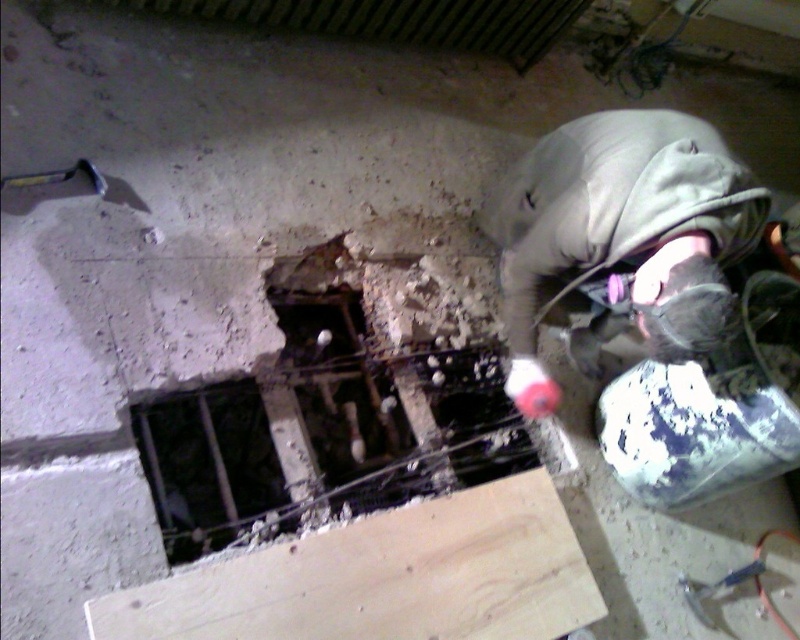
You are a safety inspector standing at the edge of the construction site. You notice the light brown wood plank at lower center and the gray fabric construction worker at upper right. Based on the distance between them, can you determine if the worker is within the safe zone required by regulations?

The light brown wood plank at lower center is 25.74 inches from gray fabric construction worker at upper right. Since the required safe distance is typically over 30 inches, the worker is too close and not within the safe zone.

You are a construction worker who needs to place a new support beam. The beam requires a base that is wider than the dark metal bars at center. Can the light brown wood plank at lower center serve as this base?

The light brown wood plank at lower center is bigger than the dark metal bars at center, so it can serve as a suitable base for the new support beam since its width exceeds that of the dark metal bars at center.

You are a construction worker who needs to place a new support beam. You have a piece of wood and some metal bars. Based on the image, which object, the light brown wood plank at lower center or the dark metal bars at center, is wider and could potentially be used as the support beam?

The light brown wood plank at lower center might be wider than the dark metal bars at center, so it could potentially be used as the support beam.